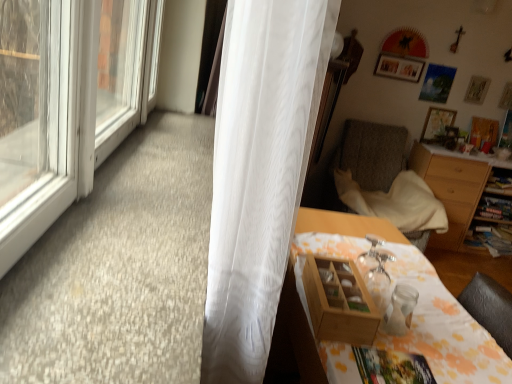
Measure the distance between wooden box at lower right and camera.

They are 3.74 feet apart.

The width and height of the screenshot is (512, 384). What do you see at coordinates (339, 302) in the screenshot?
I see `wooden box at lower right` at bounding box center [339, 302].

This screenshot has width=512, height=384. Describe the element at coordinates (386, 180) in the screenshot. I see `textured gray chair at right` at that location.

Measure the distance between point (316, 224) and camera.

Point (316, 224) is 1.90 meters from camera.

Locate an element on the screen. The image size is (512, 384). wooden photo frame at upper center, acting as the 4th picture frame starting from the right is located at coordinates (399, 67).

In order to click on wooden picture frame at upper right, the first picture frame in the right-to-left sequence in this screenshot , I will do `click(483, 131)`.

Is wooden photo frame at upper center, which is the first picture frame from left to right, oriented away from wooden picture frame at upper right, placed as the second picture frame when sorted from right to left?

No, wooden photo frame at upper center, which is the first picture frame from left to right, is not facing away from wooden picture frame at upper right, placed as the second picture frame when sorted from right to left.

Can you confirm if wooden photo frame at upper center, acting as the 4th picture frame starting from the right, is taller than wooden picture frame at upper right, placed as the second picture frame when sorted from right to left?

In fact, wooden photo frame at upper center, acting as the 4th picture frame starting from the right, may be shorter than wooden picture frame at upper right, placed as the second picture frame when sorted from right to left.

Is wooden picture frame at upper right, the third picture frame when ordered from left to right, completely or partially inside wooden photo frame at upper center, acting as the 4th picture frame starting from the right?

No, wooden picture frame at upper right, the third picture frame when ordered from left to right, is not a part of wooden photo frame at upper center, acting as the 4th picture frame starting from the right.

Which is behind, point (400, 69) or point (483, 92)?

The point (483, 92) is farther from the camera.

Considering the points (498, 124) and (367, 181), which point is in front, point (498, 124) or point (367, 181)?

The point (367, 181) is more forward.

Considering the sizes of objects wooden picture frame at upper right, the first picture frame in the right-to-left sequence, and textured gray chair at right in the image provided, who is shorter, wooden picture frame at upper right, the first picture frame in the right-to-left sequence, or textured gray chair at right?

Standing shorter between the two is wooden picture frame at upper right, the first picture frame in the right-to-left sequence.

Which object is closer to the camera, wooden picture frame at upper right, the first picture frame in the right-to-left sequence, or textured gray chair at right?

textured gray chair at right is more forward.

The image size is (512, 384). I want to click on chair in front of the wooden picture frame at upper right, the fourth picture frame in the left-to-right sequence, so click(386, 180).

Which point is more distant from viewer, (434,108) or (244,24)?

The point (434,108) is behind.

Is wooden picture frame at upper right, which appears as the third picture frame when viewed from the right, shorter than white sheer curtain at left?

Indeed, wooden picture frame at upper right, which appears as the third picture frame when viewed from the right, has a lesser height compared to white sheer curtain at left.

Is there a large distance between wooden picture frame at upper right, which is counted as the 2th picture frame, starting from the left, and white sheer curtain at left?

wooden picture frame at upper right, which is counted as the 2th picture frame, starting from the left, is far away from white sheer curtain at left.

From the image's perspective, who appears lower, wooden picture frame at upper right, which appears as the third picture frame when viewed from the right, or white sheer curtain at left?

white sheer curtain at left appears lower in the image.

Can you tell me how much wooden box at lower right and wooden picture frame at upper right, the third picture frame when ordered from left to right, differ in facing direction?

86.6 degrees separate the facing orientations of wooden box at lower right and wooden picture frame at upper right, the third picture frame when ordered from left to right.

Would you consider wooden box at lower right to be distant from wooden picture frame at upper right, placed as the second picture frame when sorted from right to left?

Yes, wooden box at lower right and wooden picture frame at upper right, placed as the second picture frame when sorted from right to left, are quite far apart.

Which is in front, wooden box at lower right or wooden picture frame at upper right, the third picture frame when ordered from left to right?

wooden box at lower right is in front.

Consider the image. Is wooden box at lower right with white sheer curtain at left?

No, wooden box at lower right is not in contact with white sheer curtain at left.

From a real-world perspective, which object stands above the other?

In real-world perspective, white sheer curtain at left is above.

Is the position of wooden box at lower right more distant than that of white sheer curtain at left?

Yes, it is behind white sheer curtain at left.

From the image's perspective, which is below, wooden box at lower right or white sheer curtain at left?

wooden box at lower right is shown below in the image.

Is textured gray chair at right positioned beyond the bounds of wooden box at lower right?

Indeed, textured gray chair at right is completely outside wooden box at lower right.

Is textured gray chair at right far from wooden box at lower right?

That's right, there is a large distance between textured gray chair at right and wooden box at lower right.

Is textured gray chair at right shorter than wooden box at lower right?

Incorrect, the height of textured gray chair at right does not fall short of that of wooden box at lower right.

Is textured gray chair at right facing away from wooden box at lower right?

textured gray chair at right does not have its back to wooden box at lower right.

Can you confirm if wooden picture frame at upper right, which is counted as the 2th picture frame, starting from the left, is shorter than wooden photo frame at upper center, which is the first picture frame from left to right?

No.

Is wooden picture frame at upper right, which is counted as the 2th picture frame, starting from the left, situated inside wooden photo frame at upper center, which is the first picture frame from left to right, or outside?

wooden picture frame at upper right, which is counted as the 2th picture frame, starting from the left, is located beyond the bounds of wooden photo frame at upper center, which is the first picture frame from left to right.

Is wooden picture frame at upper right, which is counted as the 2th picture frame, starting from the left, far away from wooden photo frame at upper center, acting as the 4th picture frame starting from the right?

They are positioned close to each other.

Find the location of a particular element. This screenshot has width=512, height=384. the 2nd picture frame counting from the left side of the wooden picture frame at upper right, placed as the second picture frame when sorted from right to left is located at coordinates (399, 67).

Locate an element on the screen. The height and width of the screenshot is (384, 512). chair below the wooden picture frame at upper right, the first picture frame in the right-to-left sequence (from the image's perspective) is located at coordinates (386, 180).

Estimate the real-world distances between objects in this image. Which object is further from wooden cabinet at right, wooden picture frame at upper right, placed as the second picture frame when sorted from right to left, or white sheer curtain at left?

Based on the image, white sheer curtain at left appears to be further to wooden cabinet at right.

Considering their positions, is wooden desk at lower right positioned closer to textured gray chair at right than wooden picture frame at upper right, placed as the second picture frame when sorted from right to left?

Based on the image, wooden picture frame at upper right, placed as the second picture frame when sorted from right to left, appears to be nearer to textured gray chair at right.

From the image, which object appears to be farther from textured gray chair at right, wooden picture frame at upper right, which appears as the third picture frame when viewed from the right, or wooden picture frame at upper right, the first picture frame in the right-to-left sequence?

wooden picture frame at upper right, the first picture frame in the right-to-left sequence, lies further to textured gray chair at right than the other object.

Based on their spatial positions, is textured gray chair at right or wooden photo frame at upper center, which is the first picture frame from left to right, further from wooden picture frame at upper right, which appears as the third picture frame when viewed from the right?

textured gray chair at right is further to wooden picture frame at upper right, which appears as the third picture frame when viewed from the right.

When comparing their distances from wooden desk at lower right, does wooden picture frame at upper right, the first picture frame in the right-to-left sequence, or wooden cabinet at right seem further?

Among the two, wooden picture frame at upper right, the first picture frame in the right-to-left sequence, is located further to wooden desk at lower right.

Based on their spatial positions, is wooden desk at lower right or wooden cabinet at right closer to wooden photo frame at upper center, which is the first picture frame from left to right?

wooden cabinet at right.

Based on their spatial positions, is wooden picture frame at upper right, which is counted as the 2th picture frame, starting from the left, or wooden cabinet at right further from wooden photo frame at upper center, acting as the 4th picture frame starting from the right?

wooden cabinet at right is further to wooden photo frame at upper center, acting as the 4th picture frame starting from the right.

Estimate the real-world distances between objects in this image. Which object is closer to wooden photo frame at upper center, which is the first picture frame from left to right, wooden box at lower right or white sheer curtain at left?

wooden box at lower right is closer to wooden photo frame at upper center, which is the first picture frame from left to right.

The height and width of the screenshot is (384, 512). What are the coordinates of `chair between white sheer curtain at left and wooden picture frame at upper right, which appears as the third picture frame when viewed from the right, along the z-axis` in the screenshot? It's located at (386, 180).

In order to click on shelf positioned between wooden desk at lower right and wooden cabinet at right from near to far in this screenshot , I will do `click(339, 302)`.

Image resolution: width=512 pixels, height=384 pixels. I want to click on shelf between wooden desk at lower right and wooden picture frame at upper right, the third picture frame when ordered from left to right, along the z-axis, so click(x=339, y=302).

Locate an element on the screen. picture frame between white sheer curtain at left and wooden picture frame at upper right, placed as the second picture frame when sorted from right to left, from front to back is located at coordinates (399, 67).